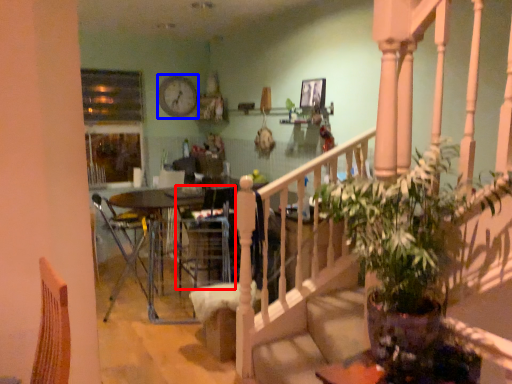
Question: Which object is closer to the camera taking this photo, armchair (highlighted by a red box) or clock (highlighted by a blue box)?

Choices:
 (A) armchair
 (B) clock

Answer: (A)